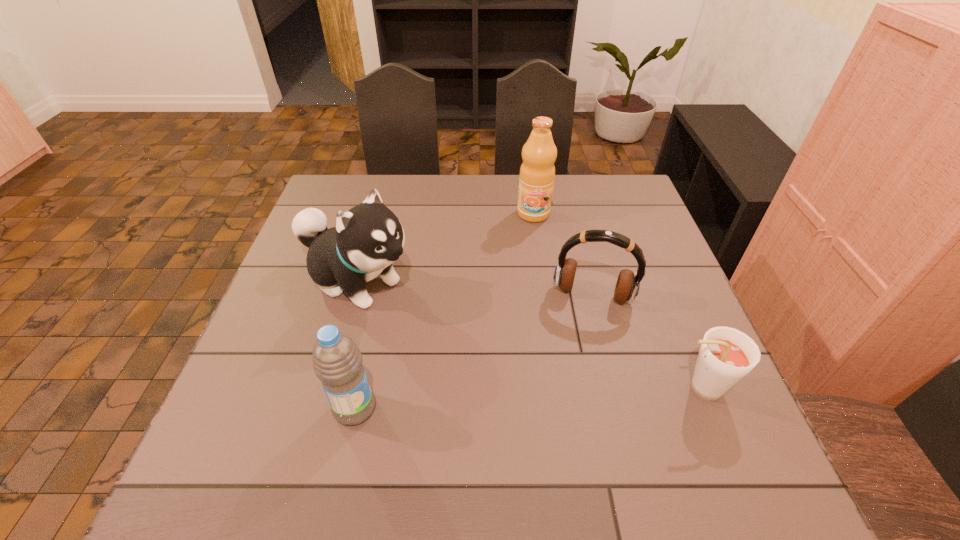
The width and height of the screenshot is (960, 540). Identify the location of free spot on the desktop that is between the water bottle and the root beer and is positioned on the ear cup of the headset. (575, 395).

You are a GUI agent. You are given a task and a screenshot of the screen. Output one action in this format:
    pyautogui.click(x=<x>, y=<y>)
    Task: Click on the free space on the desktop that is between the water bottle and the rightmost object and is positioned on the front label of the farthest object
    This screenshot has height=540, width=960.
    Given the screenshot: What is the action you would take?
    pyautogui.click(x=539, y=397)

Identify the location of vacant spot on the desktop that is between the water bottle and the root beer and is positioned at the face of the puppy. This screenshot has height=540, width=960. (558, 396).